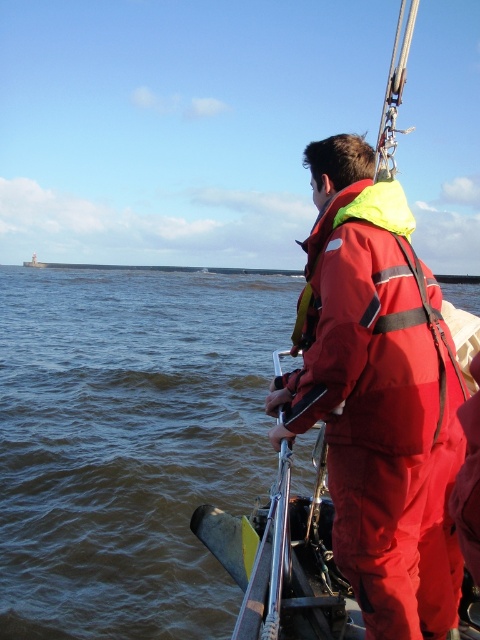
Can you confirm if brown water at center is taller than neon yellow fabric life jacket at center?

Indeed, brown water at center has a greater height compared to neon yellow fabric life jacket at center.

I want to click on brown water at center, so click(x=129, y=444).

Find the location of `brown water at center`. brown water at center is located at coordinates (x=129, y=444).

Does metallic silver boat at center appear on the left side of neon yellow fabric life jacket at center?

In fact, metallic silver boat at center is to the right of neon yellow fabric life jacket at center.

What do you see at coordinates (377, 384) in the screenshot? I see `metallic silver boat at center` at bounding box center [377, 384].

Who is more forward, (379, 323) or (412, 448)?

Positioned in front is point (412, 448).

Identify the location of metallic silver boat at center. (377, 384).

Is point (181, 550) positioned behind point (372, 627)?

Yes, point (181, 550) is farther from viewer.

The width and height of the screenshot is (480, 640). Find the location of `brown water at center`. brown water at center is located at coordinates (129, 444).